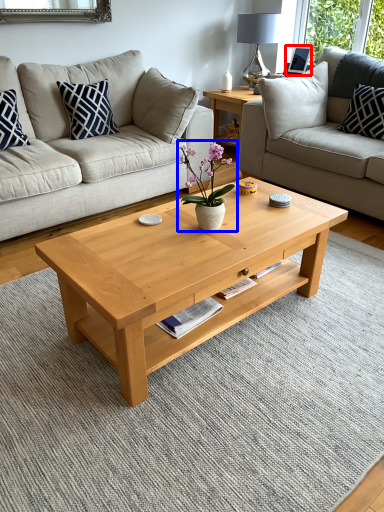
Question: Which point is further to the camera, picture frame (highlighted by a red box) or houseplant (highlighted by a blue box)?

Choices:
 (A) picture frame
 (B) houseplant

Answer: (A)